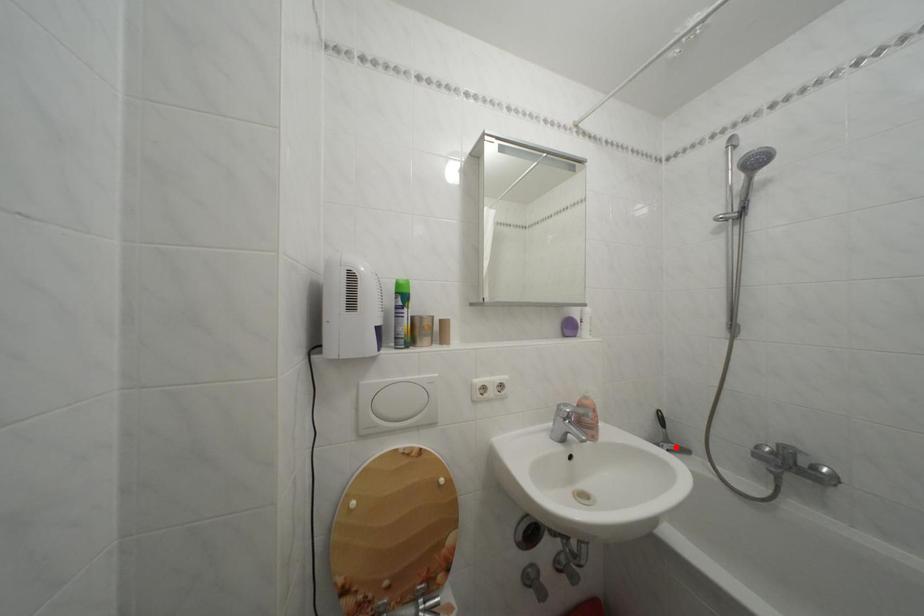
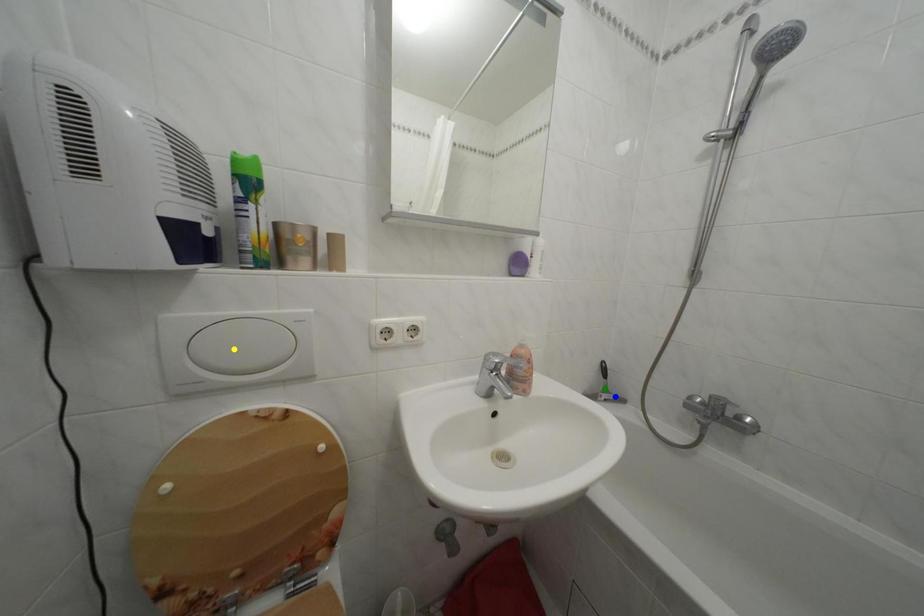
Question: I am providing you with two images of the same scene from different viewpoints. A red point is marked on the first image. You are given multiple points on the second image. In image 2, which mark is for the same physical point as the one in image 1?

Choices:
 (A) blue point
 (B) yellow point
 (C) green point

Answer: (A)